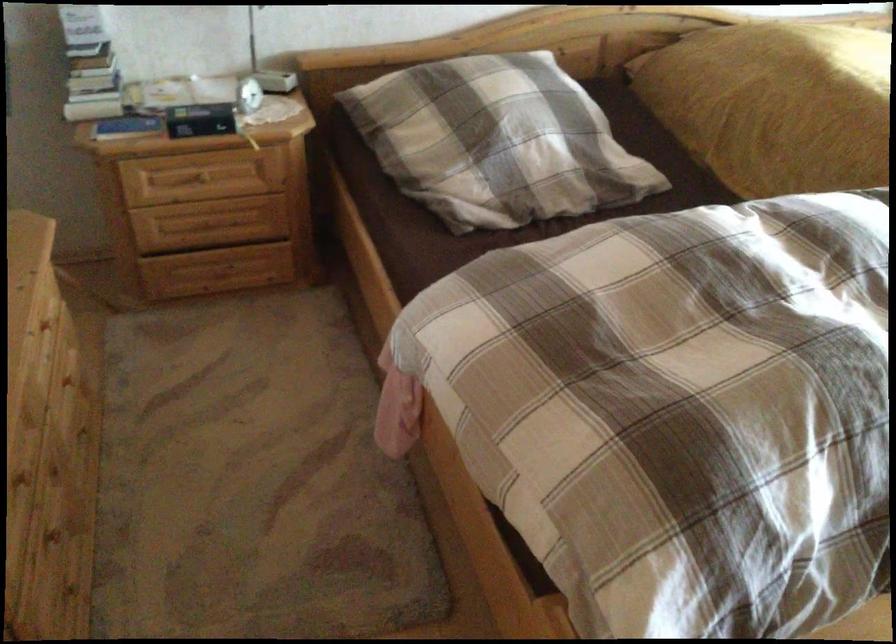
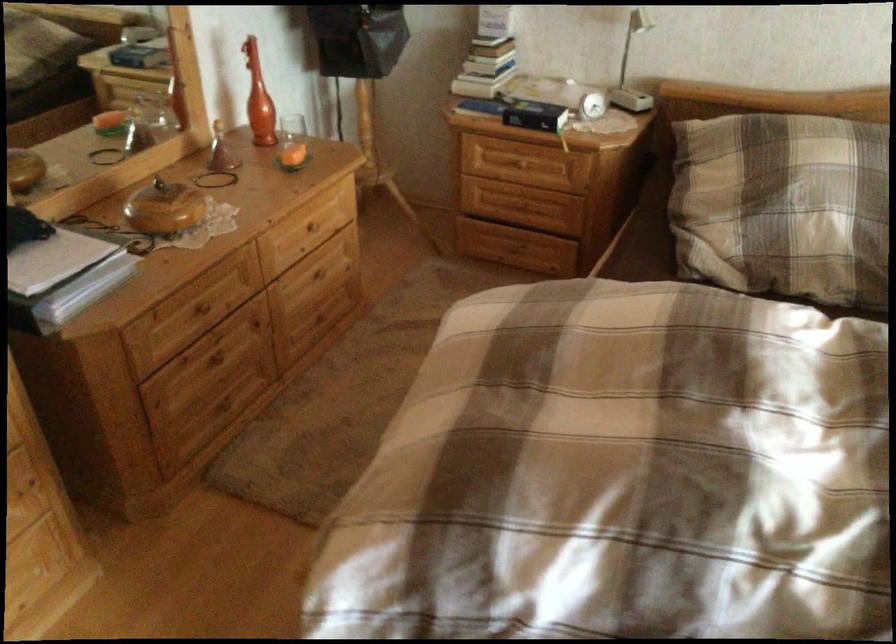
In the second image, find the point that corresponds to point 504,145 in the first image.

(782, 205)